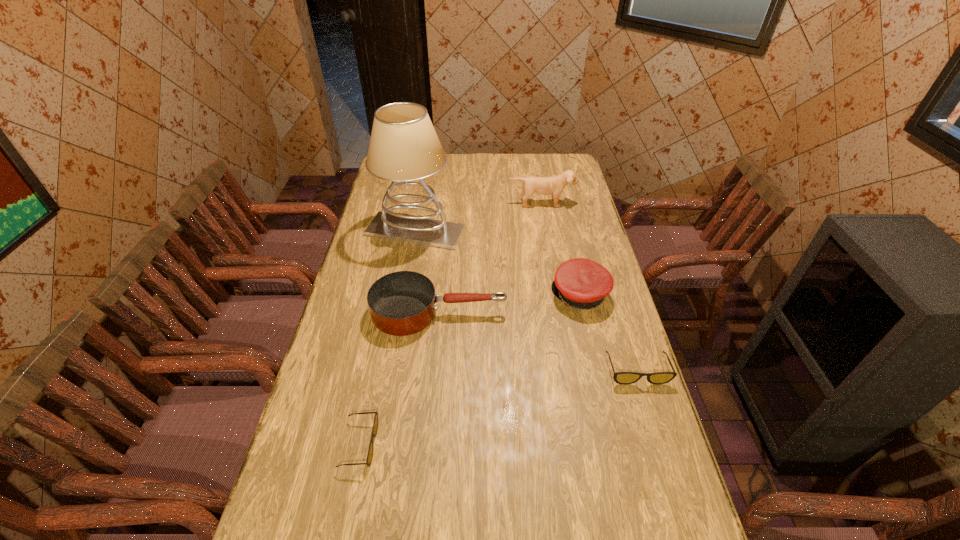
Locate an element on the screen. The image size is (960, 540). vacant space that is in between the second tallest object and the pan is located at coordinates (491, 258).

Find the location of a particular element. The image size is (960, 540). vacant space in between the cap and the farthest object is located at coordinates (561, 249).

The image size is (960, 540). Find the location of `vacant area that lies between the left sunglasses and the farthest object`. vacant area that lies between the left sunglasses and the farthest object is located at coordinates (450, 324).

You are a GUI agent. You are given a task and a screenshot of the screen. Output one action in this format:
    pyautogui.click(x=<x>, y=<y>)
    Task: Click on the vacant area that lies between the left sunglasses and the cap
    This screenshot has width=960, height=540.
    Given the screenshot: What is the action you would take?
    pyautogui.click(x=469, y=370)

Identify the location of free spot between the nearer sunglasses and the pan. [x=399, y=379].

Where is `free space between the tallest object and the farthest object`? The image size is (960, 540). free space between the tallest object and the farthest object is located at coordinates (478, 218).

Locate an element on the screen. free space between the table lamp and the pan is located at coordinates (427, 272).

Select which object appears as the fourth closest to the puppy. Please provide its 2D coordinates. Your answer should be formatted as a tuple, i.e. [(x, y)], where the tuple contains the x and y coordinates of a point satisfying the conditions above.

[(625, 378)]

This screenshot has height=540, width=960. Identify the location of object identified as the second closest to the nearer sunglasses. (581, 283).